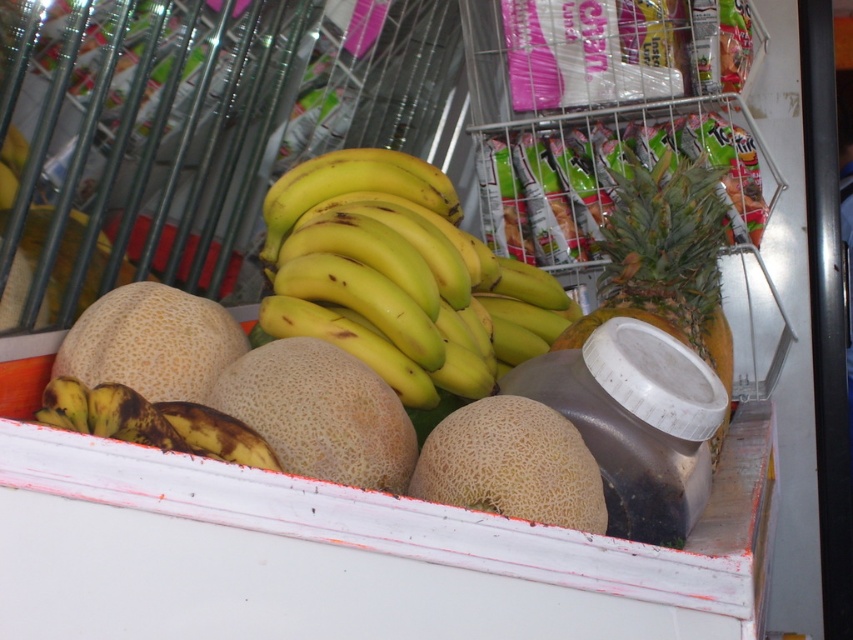
Who is higher up, yellow matte bananas at center or light brown textured cantaloupe at center?

Positioned higher is yellow matte bananas at center.

Which is in front, point (259, 323) or point (554, 500)?

Positioned in front is point (554, 500).

Who is more forward, (296, 209) or (567, 515)?

Point (567, 515) is in front.

Image resolution: width=853 pixels, height=640 pixels. Identify the location of yellow matte bananas at center. (393, 275).

Can you confirm if green spiky pineapple at center is shorter than light brown textured cantaloupe at center?

In fact, green spiky pineapple at center may be taller than light brown textured cantaloupe at center.

Can you confirm if green spiky pineapple at center is positioned to the left of light brown textured cantaloupe at center?

No, green spiky pineapple at center is not to the left of light brown textured cantaloupe at center.

Where is `green spiky pineapple at center`? The image size is (853, 640). green spiky pineapple at center is located at coordinates (665, 262).

Between point (473, 451) and point (223, 435), which one is positioned in front?

Positioned in front is point (223, 435).

Is light brown textured cantaloupe at center closer to camera compared to brown spotted banana at lower left?

No, light brown textured cantaloupe at center is further to the viewer.

Measure the distance between point (573, 429) and camera.

A distance of 3.64 feet exists between point (573, 429) and camera.

Image resolution: width=853 pixels, height=640 pixels. In order to click on light brown textured cantaloupe at center in this screenshot , I will do pyautogui.click(x=511, y=465).